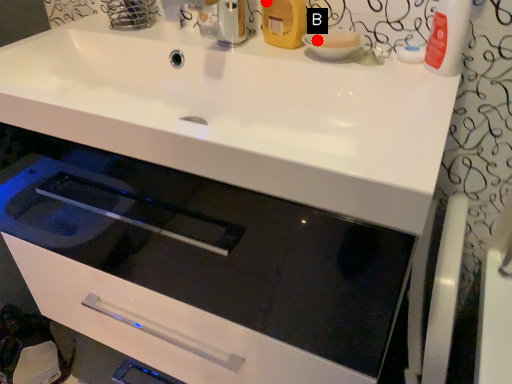
Question: Two points are circled on the image, labeled by A and B beside each circle. Which point appears closest to the camera in this image?

Choices:
 (A) A is closer
 (B) B is closer

Answer: (B)